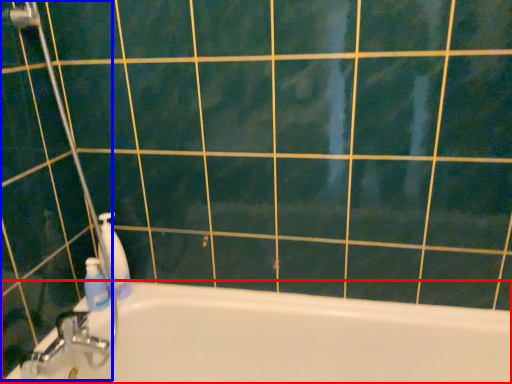
Question: Which point is further to the camera, bathtub (highlighted by a red box) or shower door (highlighted by a blue box)?

Choices:
 (A) bathtub
 (B) shower door

Answer: (B)